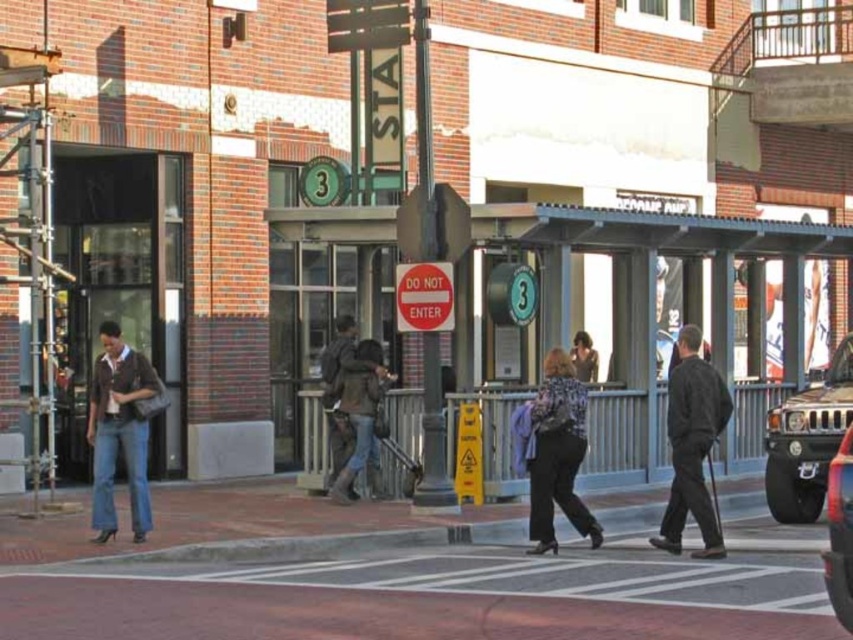
You are a delivery person trying to navigate through the pedestrian crossing. You see a denim jeans at left and a brown leather jacket at center. Which object is closer to the ground?

The denim jeans at left is positioned under the brown leather jacket at center, so the denim jeans at left is closer to the ground.

You are a delivery person needing to cross the street to deliver a package. The crosswalk is 30 feet away from your current position. There is a pedestrian wearing denim jeans at left. Can you safely reach the crosswalk before the pedestrian reaches you?

The denim jeans at left is 42.18 feet away from the camera, which is farther than the 30 feet distance to the crosswalk. Therefore, you can safely reach the crosswalk before the pedestrian.